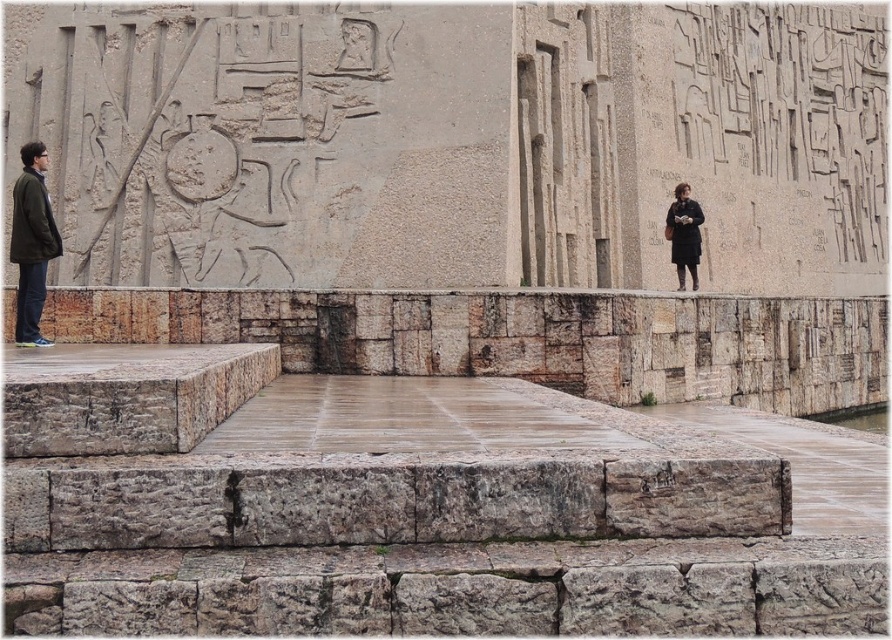
Question: Which point appears closest to the camera in this image?

Choices:
 (A) (679, 221)
 (B) (30, 157)

Answer: (B)

Question: Can you confirm if green matte jacket at left is bigger than black matte coat at right?

Choices:
 (A) yes
 (B) no

Answer: (A)

Question: Is green matte jacket at left positioned before black matte coat at right?

Choices:
 (A) no
 (B) yes

Answer: (B)

Question: Which object appears closest to the camera in this image?

Choices:
 (A) black matte coat at right
 (B) green matte jacket at left

Answer: (B)

Question: Is green matte jacket at left positioned at the back of black matte coat at right?

Choices:
 (A) no
 (B) yes

Answer: (A)